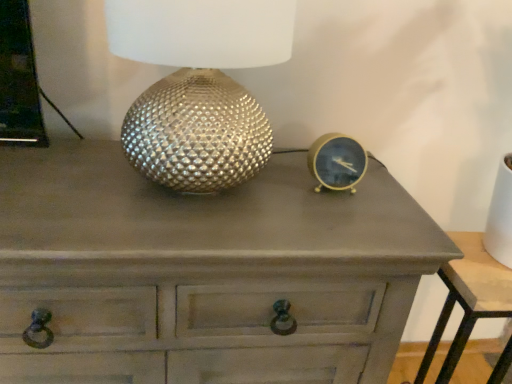
Question: Is gold metallic clock at right positioned beyond the bounds of matte gray chest of drawers at center?

Choices:
 (A) yes
 (B) no

Answer: (A)

Question: Is matte gray chest of drawers at center inside gold metallic clock at right?

Choices:
 (A) no
 (B) yes

Answer: (A)

Question: Is the surface of gold metallic clock at right in direct contact with matte gray chest of drawers at center?

Choices:
 (A) no
 (B) yes

Answer: (A)

Question: Is gold metallic clock at right to the right of matte gray chest of drawers at center from the viewer's perspective?

Choices:
 (A) no
 (B) yes

Answer: (B)

Question: From the image's perspective, is gold metallic clock at right over matte gray chest of drawers at center?

Choices:
 (A) no
 (B) yes

Answer: (B)

Question: Can you confirm if gold metallic clock at right is smaller than matte gray chest of drawers at center?

Choices:
 (A) no
 (B) yes

Answer: (B)

Question: Is matte gray nightstand at lower right aimed at matte gray chest of drawers at center?

Choices:
 (A) no
 (B) yes

Answer: (A)

Question: From a real-world perspective, is matte gray nightstand at lower right located beneath matte gray chest of drawers at center?

Choices:
 (A) no
 (B) yes

Answer: (B)

Question: Considering the relative sizes of matte gray nightstand at lower right and matte gray chest of drawers at center in the image provided, is matte gray nightstand at lower right taller than matte gray chest of drawers at center?

Choices:
 (A) no
 (B) yes

Answer: (A)

Question: Can you confirm if matte gray nightstand at lower right is smaller than matte gray chest of drawers at center?

Choices:
 (A) no
 (B) yes

Answer: (B)

Question: Is matte gray nightstand at lower right directly adjacent to matte gray chest of drawers at center?

Choices:
 (A) yes
 (B) no

Answer: (B)

Question: Considering the relative positions of matte gray nightstand at lower right and matte gray chest of drawers at center in the image provided, is matte gray nightstand at lower right to the right of matte gray chest of drawers at center from the viewer's perspective?

Choices:
 (A) yes
 (B) no

Answer: (A)

Question: Considering the relative sizes of matte gray nightstand at lower right and metallic textured lamp at center in the image provided, is matte gray nightstand at lower right shorter than metallic textured lamp at center?

Choices:
 (A) no
 (B) yes

Answer: (A)